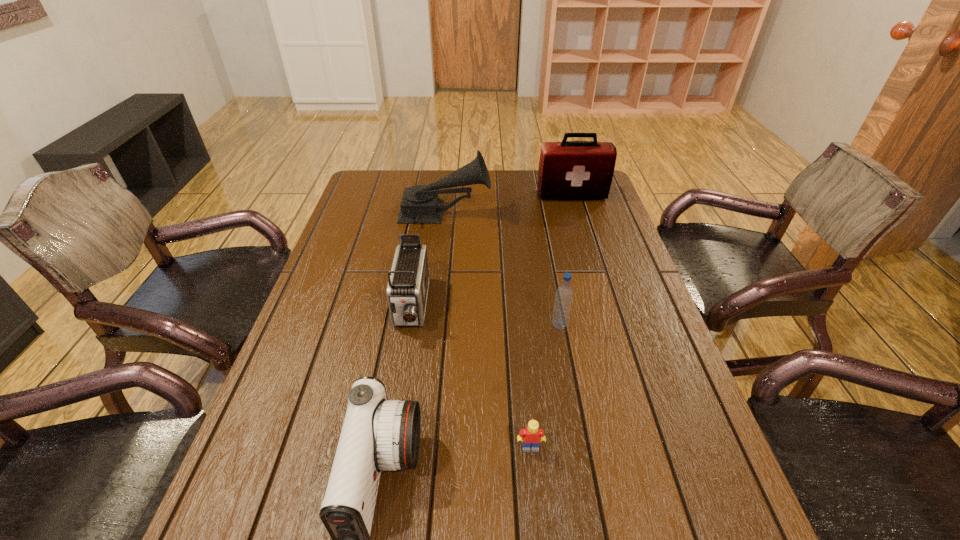
Where is `the first aid kit`? the first aid kit is located at coordinates (569, 170).

This screenshot has height=540, width=960. In order to click on phonograph_record in this screenshot , I will do `click(420, 204)`.

Identify the location of the farther camcorder. The width and height of the screenshot is (960, 540). (408, 281).

The height and width of the screenshot is (540, 960). I want to click on water bottle, so coord(564,294).

You are a GUI agent. You are given a task and a screenshot of the screen. Output one action in this format:
    pyautogui.click(x=<x>, y=<y>)
    Task: Click on the shortest object
    
    Given the screenshot: What is the action you would take?
    pyautogui.click(x=531, y=436)

Where is `Lego`? The height and width of the screenshot is (540, 960). Lego is located at coordinates (531, 436).

The height and width of the screenshot is (540, 960). Identify the location of vacant space situated on the side of the first aid kit with the cross symbol. (579, 220).

At what (x,y) coordinates should I click in order to perform the action: click on vacant point located from the horn of the phonograph_record. Please return your answer as a coordinate pair (x, y). The height and width of the screenshot is (540, 960). Looking at the image, I should click on (597, 214).

This screenshot has height=540, width=960. I want to click on vacant space positioned at the lens of the farther camcorder, so point(396,397).

At what (x,y) coordinates should I click in order to perform the action: click on free space located on the left of the water bottle. Please return your answer as a coordinate pair (x, y). The image size is (960, 540). Looking at the image, I should click on (471, 326).